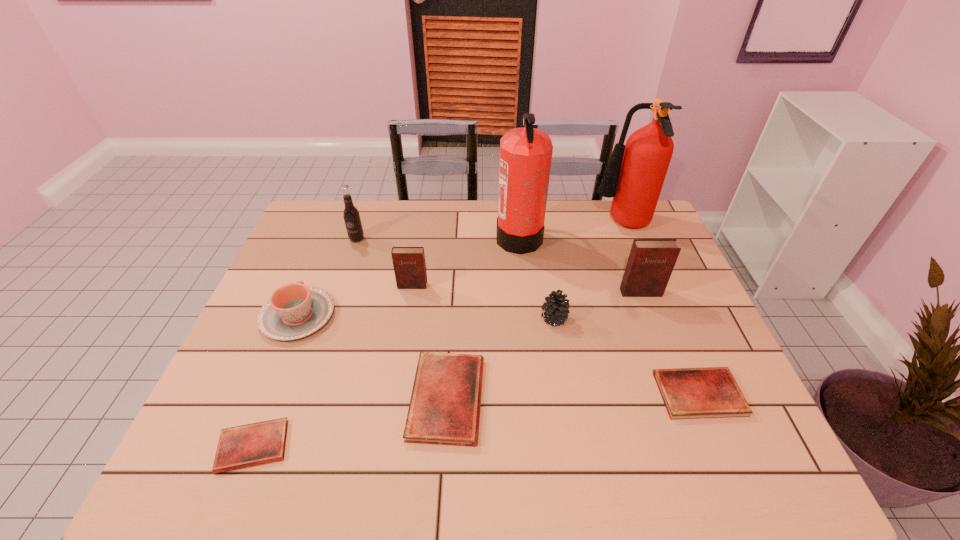
Locate which red diary ranks in proximity to the smallest red diary. Please provide its 2D coordinates. Your answer should be formatted as a tuple, i.e. [(x, y)], where the tuple contains the x and y coordinates of a point satisfying the conditions above.

[(444, 409)]

The width and height of the screenshot is (960, 540). Identify the location of free region that satisfies the following two spatial constraints: 1. at the nozzle of the red fire extinguisher; 2. on the front cover of the second tallest diary. (645, 286).

Locate an element on the screen. The image size is (960, 540). free location that satisfies the following two spatial constraints: 1. on the front side of the left fire extinguisher; 2. on the right side of the second shortest object is located at coordinates (536, 394).

The height and width of the screenshot is (540, 960). I want to click on free spot that satisfies the following two spatial constraints: 1. at the nozzle of the right fire extinguisher; 2. on the front cover of the second tallest diary, so click(645, 286).

Identify the location of blank area in the image that satisfies the following two spatial constraints: 1. on the label of the root beer; 2. on the right side of the ninth tallest object. This screenshot has height=540, width=960. (306, 394).

Locate an element on the screen. This screenshot has width=960, height=540. free space that satisfies the following two spatial constraints: 1. on the front side of the black fire extinguisher; 2. on the front cover of the sixth shortest object is located at coordinates (524, 286).

Where is `free space that satisfies the following two spatial constraints: 1. on the label of the second shortest diary; 2. on the left side of the root beer`? The width and height of the screenshot is (960, 540). free space that satisfies the following two spatial constraints: 1. on the label of the second shortest diary; 2. on the left side of the root beer is located at coordinates (306, 394).